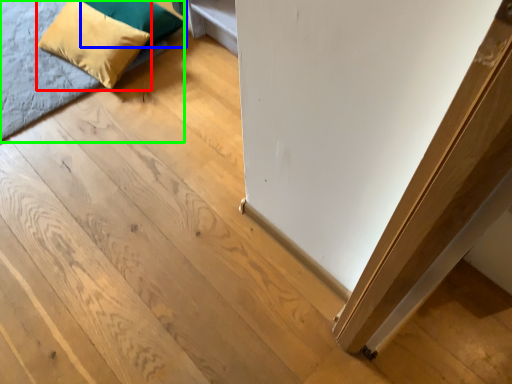
Question: Considering the real-world distances, which object is closest to pillow (highlighted by a red box)? pillow (highlighted by a blue box) or bed (highlighted by a green box).

Choices:
 (A) pillow
 (B) bed

Answer: (A)